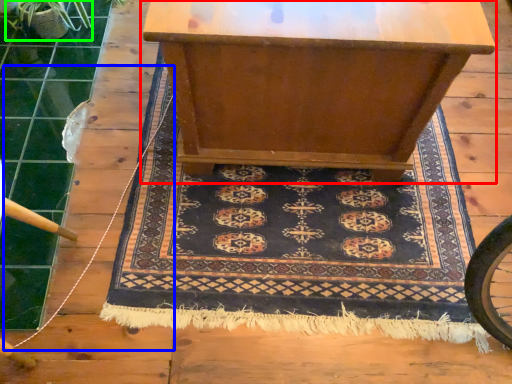
Question: Which object is the closest to the table (highlighted by a red box)? Choose among these: string (highlighted by a blue box) or plant (highlighted by a green box).

Choices:
 (A) string
 (B) plant

Answer: (A)